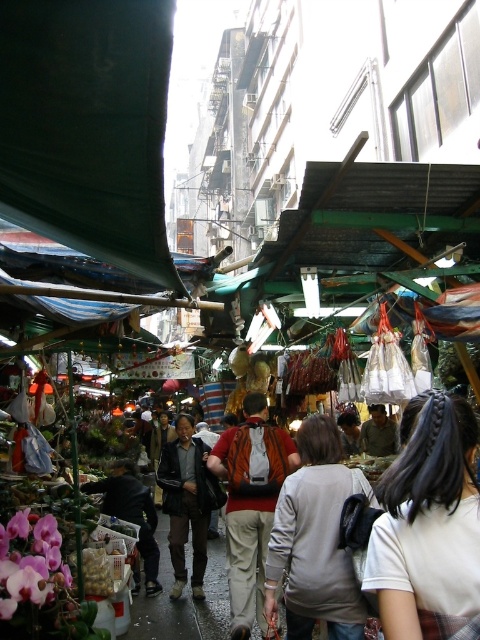
Question: Is white matte hair at center wider than gray fabric shirt at center?

Choices:
 (A) no
 (B) yes

Answer: (A)

Question: Does gray fabric shirt at center appear on the left side of dark gray leather jacket at lower left?

Choices:
 (A) no
 (B) yes

Answer: (A)

Question: Where is orange fabric backpack at center located in relation to dark brown leather jacket at center in the image?

Choices:
 (A) below
 (B) above

Answer: (A)

Question: Which is farther from the dark green fabric canopy at upper left?

Choices:
 (A) gray fabric shirt at center
 (B) white matte hair at center
 (C) brown leather jacket at center
 (D) orange fabric backpack at center

Answer: (C)

Question: Which point appears closest to the camera in this image?

Choices:
 (A) (389, 428)
 (B) (78, 49)

Answer: (B)

Question: Based on their relative distances, which object is nearer to the dark gray leather jacket at lower left?

Choices:
 (A) dark brown leather jacket at center
 (B) dark green fabric canopy at upper left

Answer: (A)